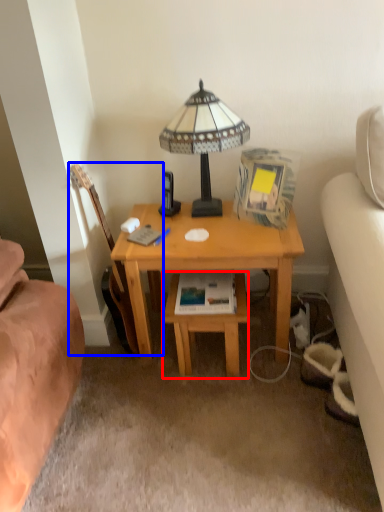
Question: Which object is closer to the camera taking this photo, table (highlighted by a red box) or guitar (highlighted by a blue box)?

Choices:
 (A) table
 (B) guitar

Answer: (B)